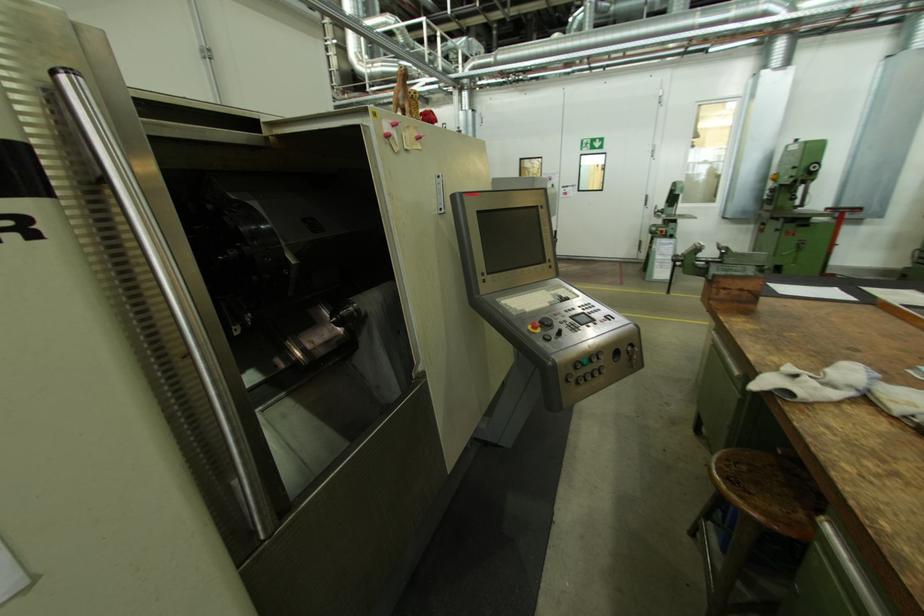
What are the coordinates of `red push button` in the screenshot? It's located at (535, 326).